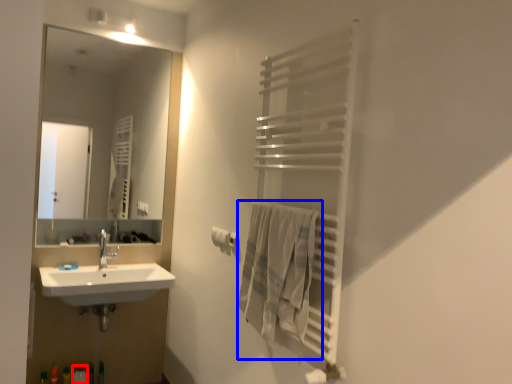
Question: Which of the following is the closest to the observer, toiletry (highlighted by a red box) or bath towel (highlighted by a blue box)?

Choices:
 (A) toiletry
 (B) bath towel

Answer: (B)